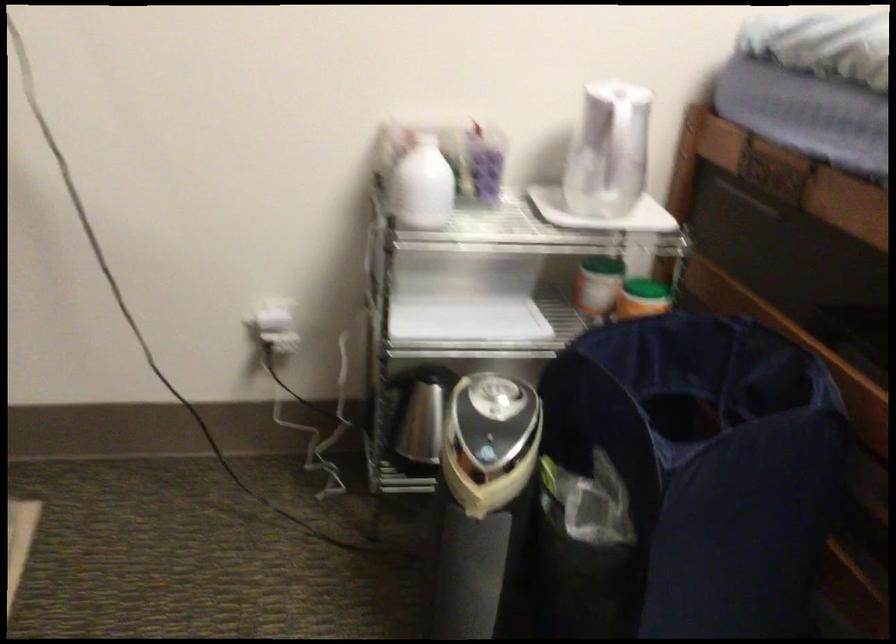
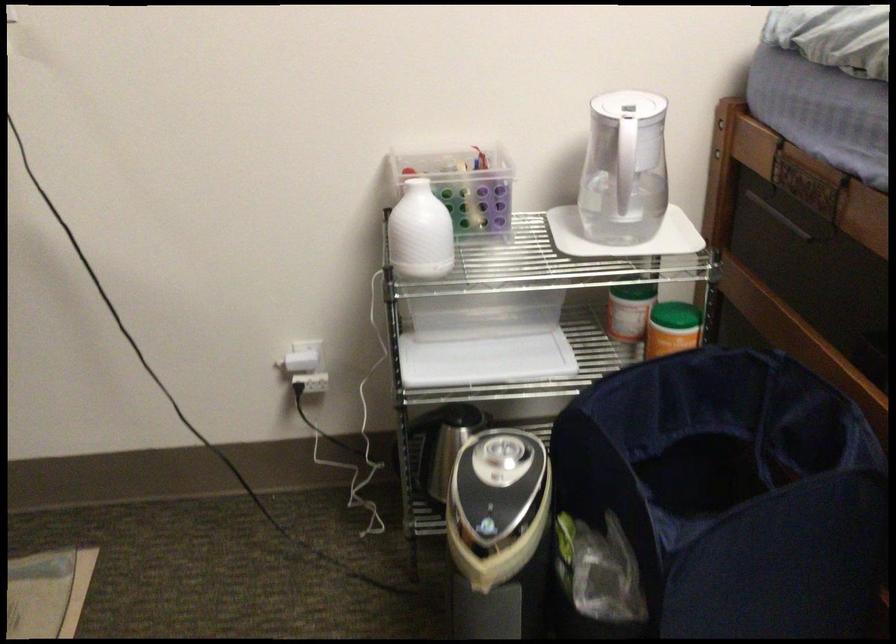
In the second image, find the point that corresponds to point (498, 460) in the first image.

(498, 534)